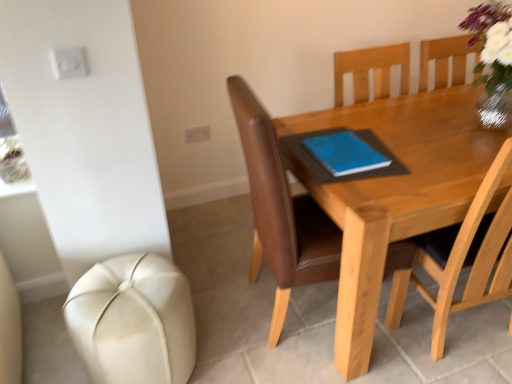
Where is `vacant space positioned to the left of brown leather chair at center`? The height and width of the screenshot is (384, 512). vacant space positioned to the left of brown leather chair at center is located at coordinates (219, 296).